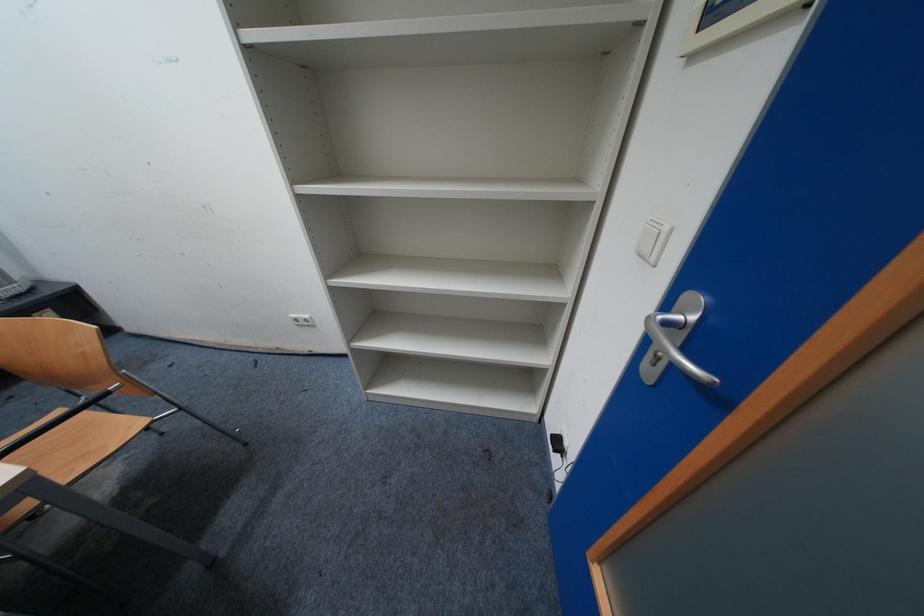
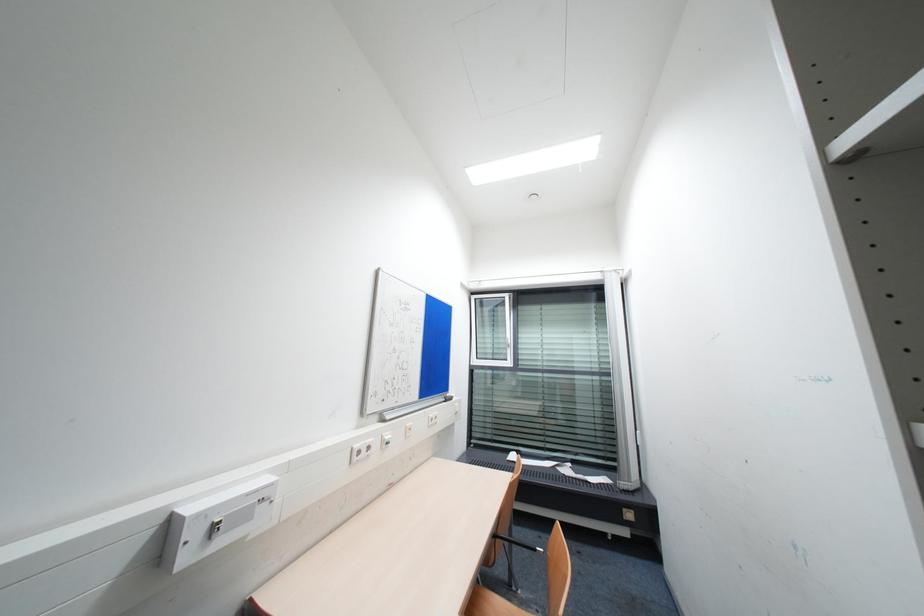
Question: The first image is from the beginning of the video and the second image is from the end. How did the camera likely rotate when shooting the video?

Choices:
 (A) Left
 (B) Right
 (C) Up
 (D) Down

Answer: (A)